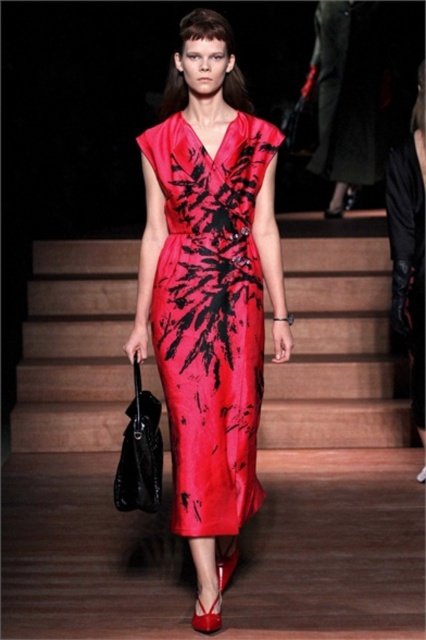
Question: Which point is farther to the camera?

Choices:
 (A) (132, 243)
 (B) (411, 394)
 (C) (242, 116)

Answer: (A)

Question: Can you confirm if satin stairs at center is positioned to the left of silky black dress at right?

Choices:
 (A) yes
 (B) no

Answer: (A)

Question: Which object appears closest to the camera in this image?

Choices:
 (A) silky black dress at right
 (B) shiny silk dress at center
 (C) satin stairs at center

Answer: (C)

Question: Among these objects, which one is farthest from the camera?

Choices:
 (A) silky black dress at right
 (B) shiny silk dress at center
 (C) satin stairs at center

Answer: (A)

Question: Can you confirm if shiny silk dress at center is positioned to the right of silky black dress at right?

Choices:
 (A) no
 (B) yes

Answer: (A)

Question: Can you confirm if satin stairs at center is positioned to the left of shiny silk dress at center?

Choices:
 (A) yes
 (B) no

Answer: (A)